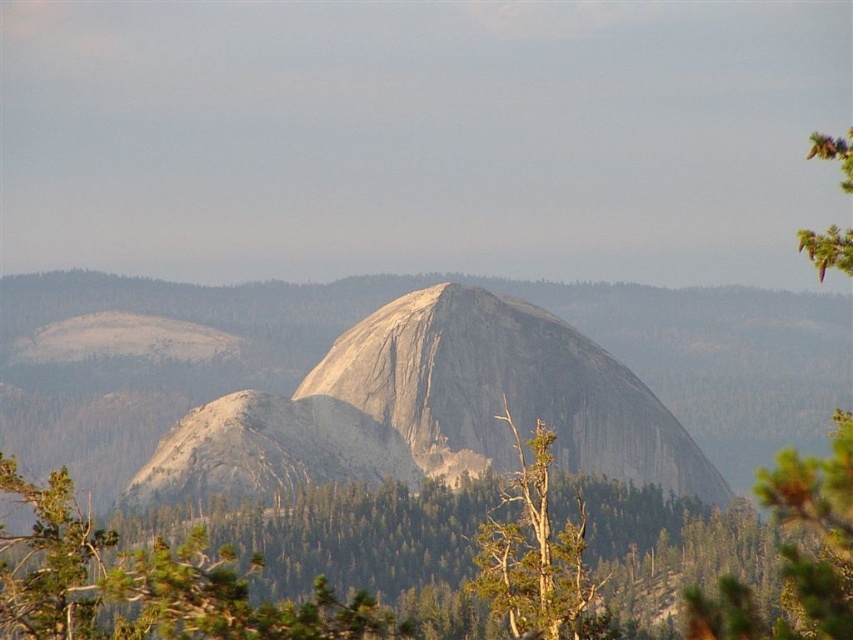
You are standing at the bottom of the granite dome and want to find the green leafy tree at center. According to the 2D coordinates given, in which direction should you look to find it?

The green leafy tree at center is located at coordinates 0.912 on the x axis and 0.176 on the y axis. Since the x coordinate is closer to 1, it means the tree is positioned to the right side. The y coordinate being closer to 0 indicates it is lower down in the image. Therefore, you should look to the lower right direction to find the green leafy tree at center.

You are a park ranger planning to install a new trail between the green leafy tree at center and the green leafy tree at upper right. The trail must be exactly 120 meters long. Based on the distance provided, will the trail fit perfectly between them?

The distance between the green leafy tree at center and the green leafy tree at upper right is 126.34 meters. Since the trail is only 120 meters long, it will not fit perfectly as it is shorter than the required distance between the two trees.